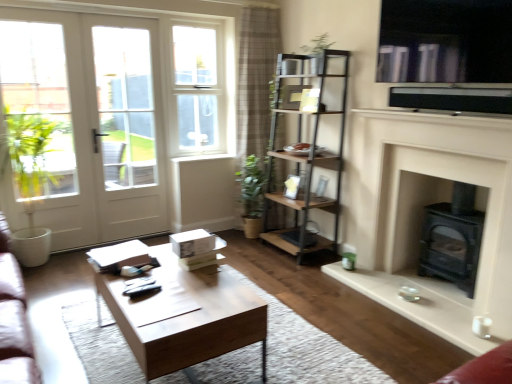
This screenshot has width=512, height=384. Describe the element at coordinates (452, 239) in the screenshot. I see `black matte wood burning stove at lower right` at that location.

Measure the distance between point (433,206) and camera.

A distance of 3.32 meters exists between point (433,206) and camera.

What do you see at coordinates (256, 79) in the screenshot?
I see `plaid fabric curtain at upper center` at bounding box center [256, 79].

What do you see at coordinates (91, 120) in the screenshot? Image resolution: width=512 pixels, height=384 pixels. I see `white glossy door at left` at bounding box center [91, 120].

Describe the element at coordinates (202, 158) in the screenshot. The width and height of the screenshot is (512, 384). I see `white wood window sill at center` at that location.

Where is `white wood window sill at center`? The width and height of the screenshot is (512, 384). white wood window sill at center is located at coordinates (202, 158).

Locate an element on the screen. white glass screen door at left is located at coordinates (128, 128).

Locate an element on the screen. The image size is (512, 384). black matte wood burning stove at lower right is located at coordinates [x=452, y=239].

Could you tell me if wooden coffee table at center is turned towards white glossy door at left?

No, wooden coffee table at center is not turned towards white glossy door at left.

Identify the location of coffee table on the right of white glossy door at left. tap(185, 316).

Which is in front, point (172, 264) or point (123, 90)?

The point (172, 264) is in front.

Can you confirm if white glass door at left is shorter than white glossy door at left?

Indeed, white glass door at left has a lesser height compared to white glossy door at left.

Is the surface of white glass door at left in direct contact with white glossy door at left?

There is a gap between white glass door at left and white glossy door at left.

Considering the positions of points (16, 61) and (118, 229), is point (16, 61) farther from camera compared to point (118, 229)?

That is False.

From the image's perspective, who appears lower, white glass door at left or white glossy door at left?

white glass door at left appears lower in the image.

Who is bigger, metallic brown shelf at center or white plastic window at upper center?

metallic brown shelf at center is bigger.

From the image's perspective, is metallic brown shelf at center positioned above or below white plastic window at upper center?

metallic brown shelf at center is situated lower than white plastic window at upper center in the image.

Can you tell me how much metallic brown shelf at center and white plastic window at upper center differ in facing direction?

metallic brown shelf at center and white plastic window at upper center are facing 89.1 degrees away from each other.

The width and height of the screenshot is (512, 384). I want to click on shelf in front of the white plastic window at upper center, so click(x=306, y=147).

Could you tell me if wooden coffee table at center is facing white wood window sill at center?

No, wooden coffee table at center is not oriented towards white wood window sill at center.

In the scene shown: From a real-world perspective, which is physically below, wooden coffee table at center or white wood window sill at center?

In real-world perspective, wooden coffee table at center is lower.

Does point (138, 356) come behind point (225, 158)?

No, (138, 356) is closer to viewer.

Image resolution: width=512 pixels, height=384 pixels. I want to click on coffee table on the right of white wood window sill at center, so click(185, 316).

Could you tell me if white glass screen door at left is facing plaid fabric curtain at upper center?

No.

Which is more to the left, white glass screen door at left or plaid fabric curtain at upper center?

white glass screen door at left is more to the left.

Is white glass screen door at left not inside plaid fabric curtain at upper center?

Indeed, white glass screen door at left is completely outside plaid fabric curtain at upper center.

Is point (452, 121) closer or farther from the camera than point (258, 89)?

Point (452, 121).

Which is behind, white matte fireplace at right or plaid fabric curtain at upper center?

Positioned behind is plaid fabric curtain at upper center.

Considering the relative sizes of white matte fireplace at right and plaid fabric curtain at upper center in the image provided, is white matte fireplace at right thinner than plaid fabric curtain at upper center?

Yes.

Locate an element on the screen. fireplace that appears in front of the plaid fabric curtain at upper center is located at coordinates (423, 215).

Is metallic silver window screen at upper right wider than metallic brown shelf at center?

Incorrect, the width of metallic silver window screen at upper right does not surpass that of metallic brown shelf at center.

From the image's perspective, between metallic silver window screen at upper right and metallic brown shelf at center, which one is located above?

From the image's view, metallic silver window screen at upper right is above.

Between metallic silver window screen at upper right and metallic brown shelf at center, which one appears on the right side from the viewer's perspective?

Positioned to the right is metallic silver window screen at upper right.

The height and width of the screenshot is (384, 512). In order to click on coffee table beneath the white glossy door at left (from a real-world perspective) in this screenshot , I will do `click(185, 316)`.

Identify the location of door in front of the white glass door at left. (91, 120).

Based on their spatial positions, is white plastic window at upper center or white wood window sill at center further from wooden coffee table at center?

Among the two, white plastic window at upper center is located further to wooden coffee table at center.

Based on their spatial positions, is wooden coffee table at center or white plastic window at upper center closer to metallic silver window screen at upper right?

wooden coffee table at center is closer to metallic silver window screen at upper right.

When comparing their distances from wooden coffee table at center, does metallic brown shelf at center or white glass door at left seem further?

white glass door at left.

Based on their spatial positions, is wooden coffee table at center or black matte wood burning stove at lower right further from plaid fabric curtain at upper center?

Among the two, wooden coffee table at center is located further to plaid fabric curtain at upper center.

Estimate the real-world distances between objects in this image. Which object is further from white glass screen door at left, wooden coffee table at center or metallic brown shelf at center?

wooden coffee table at center lies further to white glass screen door at left than the other object.

Looking at the image, which one is located closer to white glass screen door at left, plaid fabric curtain at upper center or black matte wood burning stove at lower right?

Among the two, plaid fabric curtain at upper center is located nearer to white glass screen door at left.

From the image, which object appears to be nearer to white plastic window at upper center, plaid fabric curtain at upper center or white matte fireplace at right?

plaid fabric curtain at upper center.

In the scene shown: Which object lies nearer to the anchor point white matte fireplace at right, black matte wood burning stove at lower right or plaid fabric curtain at upper center?

black matte wood burning stove at lower right lies closer to white matte fireplace at right than the other object.

Locate an element on the screen. The width and height of the screenshot is (512, 384). screen door between wooden coffee table at center and plaid fabric curtain at upper center in the front-back direction is located at coordinates (128, 128).

Locate an element on the screen. curtain between white glass screen door at left and white matte fireplace at right from left to right is located at coordinates (256, 79).

Where is `shelf situated between white glossy door at left and metallic silver window screen at upper right from left to right`? This screenshot has height=384, width=512. shelf situated between white glossy door at left and metallic silver window screen at upper right from left to right is located at coordinates (306, 147).

Identify the location of bay window positioned between wooden coffee table at center and white glass screen door at left from near to far. Image resolution: width=512 pixels, height=384 pixels. (39, 105).